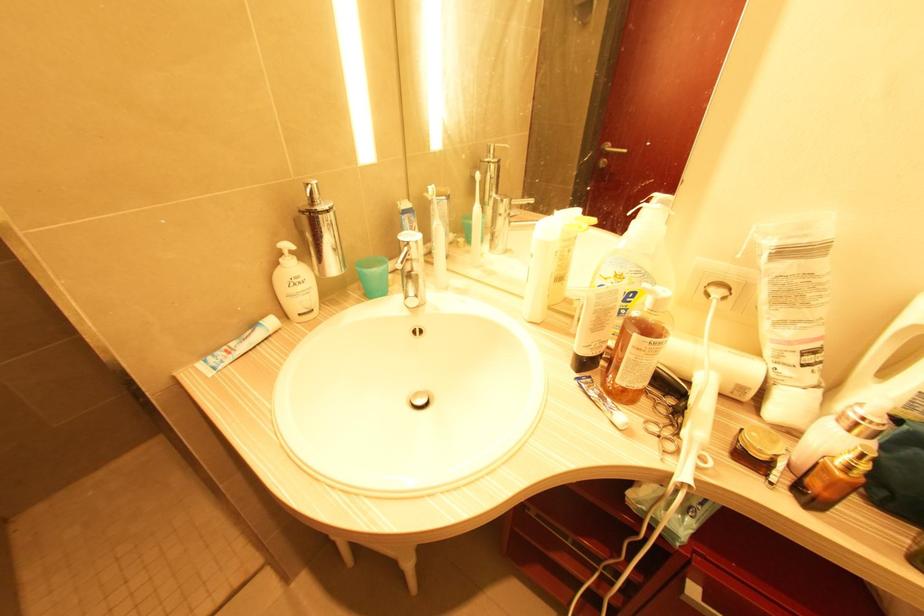
Where is `white pump dispenser`? Image resolution: width=924 pixels, height=616 pixels. white pump dispenser is located at coordinates (638, 254).